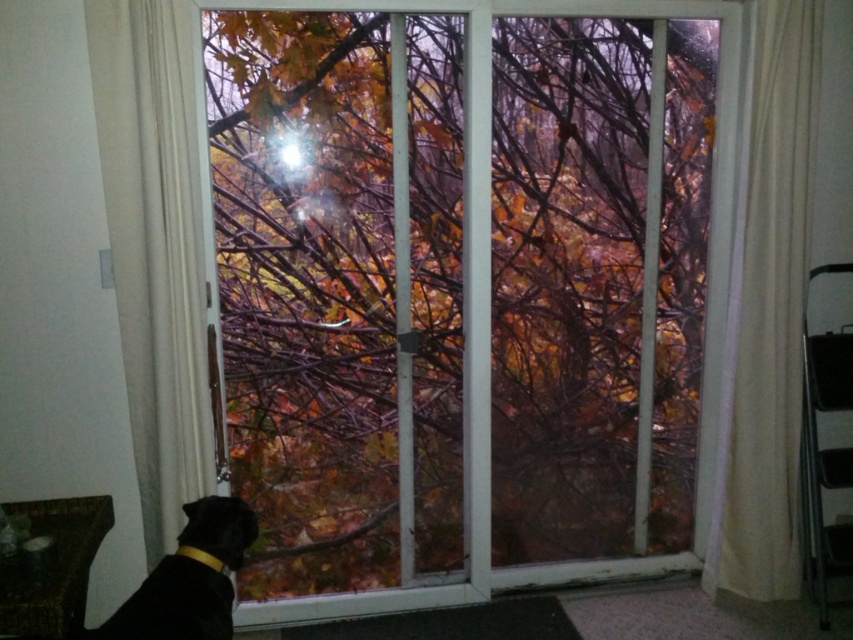
Which of these two, white fabric curtain at right or transparent glass window at center, stands shorter?

Standing shorter between the two is white fabric curtain at right.

Image resolution: width=853 pixels, height=640 pixels. What are the coordinates of `white fabric curtain at right` in the screenshot? It's located at point(767,316).

Is white sheer curtain at left shorter than black fur dog at lower left?

No.

Which is more to the right, white sheer curtain at left or black fur dog at lower left?

black fur dog at lower left is more to the right.

I want to click on white sheer curtain at left, so click(155, 248).

Can you confirm if white sheer curtain at left is positioned to the right of white fabric curtain at right?

Incorrect, white sheer curtain at left is not on the right side of white fabric curtain at right.

Who is taller, white sheer curtain at left or white fabric curtain at right?

With more height is white fabric curtain at right.

Measure the distance between white sheer curtain at left and camera.

white sheer curtain at left is 2.39 meters away from camera.

What are the coordinates of `white sheer curtain at left` in the screenshot? It's located at (155, 248).